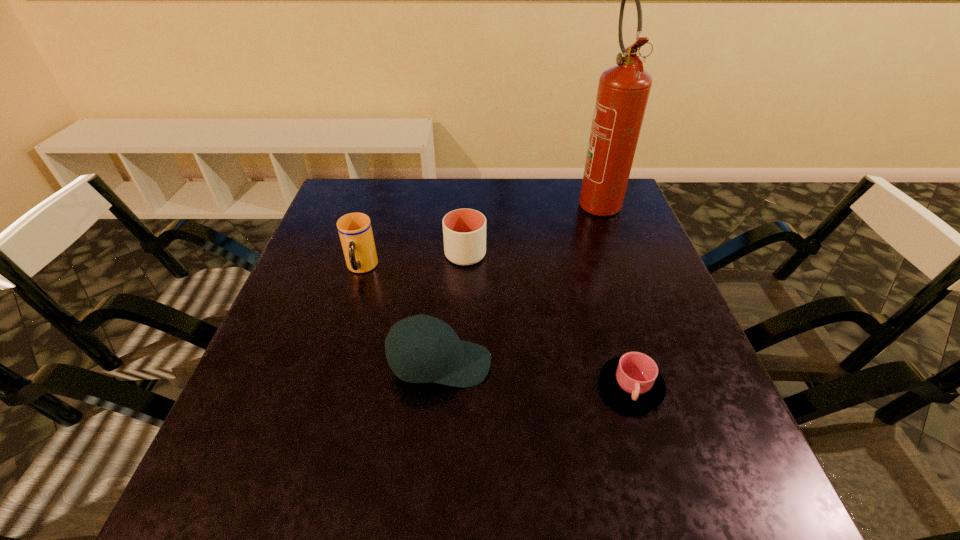
Where is `vacant position located on the front-facing side of the baseball cap`? This screenshot has height=540, width=960. vacant position located on the front-facing side of the baseball cap is located at coordinates pos(657,364).

The width and height of the screenshot is (960, 540). Identify the location of free space located on the right of the second tallest cup. (572, 254).

Locate an element on the screen. free space located on the side with the handle of the rightmost cup is located at coordinates (669, 516).

Identify the location of object that is at the far edge. (623, 91).

Find the location of `object that is positioned at the left edge`. object that is positioned at the left edge is located at coordinates tap(355, 231).

The image size is (960, 540). I want to click on fire extinguisher situated at the right edge, so click(x=623, y=91).

Find the location of `cup that is at the right edge`. cup that is at the right edge is located at coordinates (632, 380).

Locate an element on the screen. The width and height of the screenshot is (960, 540). object that is at the far right corner is located at coordinates (623, 91).

At what (x,y) coordinates should I click in order to perform the action: click on blank space at the far edge of the desktop. Please return your answer as a coordinate pair (x, y). The image size is (960, 540). Looking at the image, I should click on (447, 201).

You are a GUI agent. You are given a task and a screenshot of the screen. Output one action in this format:
    pyautogui.click(x=<x>, y=<y>)
    Task: Click on the vacant area at the near edge of the desktop
    The image size is (960, 540).
    Given the screenshot: What is the action you would take?
    pyautogui.click(x=436, y=480)